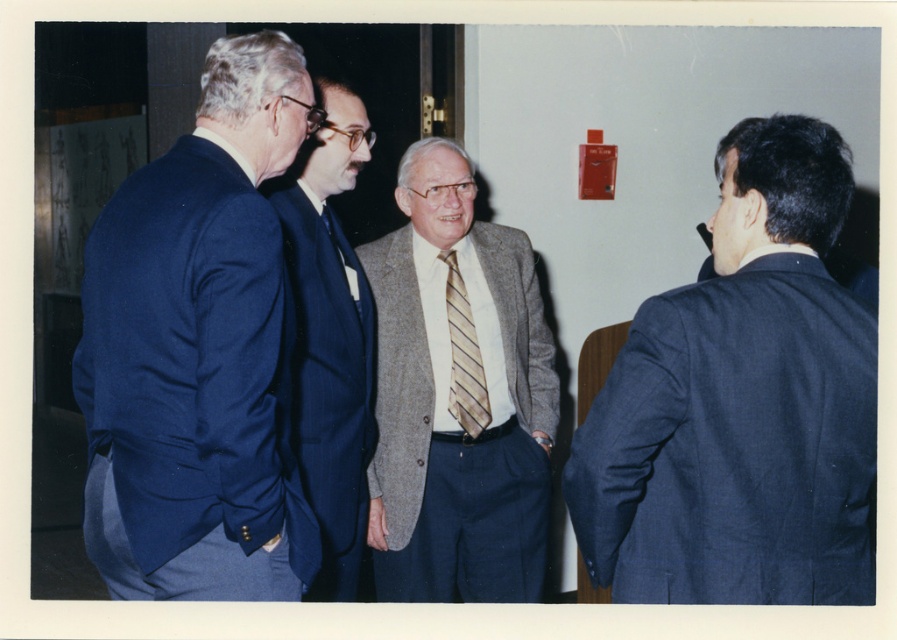
You are a photographer setting up for a group photo. You need to position the dark blue suit at right and the gray textured blazer at center so that both are fully visible in the frame. Given their heights, which person should stand closer to the camera to ensure their entire body is captured without cropping?

The dark blue suit at right is shorter than the gray textured blazer at center. To ensure both are fully visible, the shorter dark blue suit at right should stand closer to the camera while the taller gray textured blazer at center can be positioned slightly behind. This way, the height difference is accommodated, and both individuals will fit within the frame without cropping.

You are standing at the camera position and want to reach the point marked at coordinates (106,433). Can you estimate how far you need to walk to reach that point?

The point marked at coordinates (106,433) is 1.75 meters away from the camera, so you need to walk approximately 1.75 meters to reach it.

You are at the center of the image and need to locate the dark blue suit at right. According to the coordinates provided, in which direction should you look to find it?

The dark blue suit at right is located at coordinates point (742, 404), which means it is to the right and slightly above your current position at the center. You should look to your right and slightly upwards to locate it.